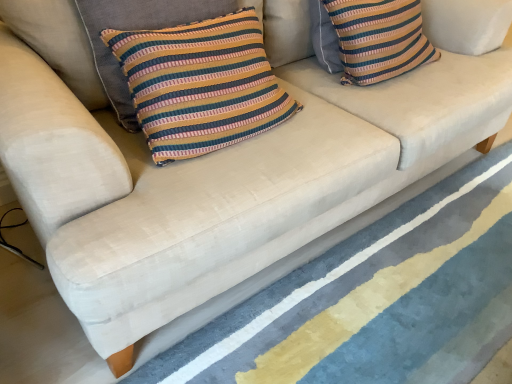
Question: Which direction should I rotate to face striped fabric pillow at center, the first pillow in the left-to-right sequence, — up or down?

Choices:
 (A) up
 (B) down

Answer: (A)

Question: Is striped fabric pillow at center, the first pillow in the left-to-right sequence, wider than striped fabric pillow at upper right, the first pillow when ordered from back to front?

Choices:
 (A) no
 (B) yes

Answer: (A)

Question: Can you confirm if striped fabric pillow at center, the first pillow viewed from the front, is bigger than striped fabric pillow at upper right, acting as the 2th pillow starting from the left?

Choices:
 (A) yes
 (B) no

Answer: (B)

Question: Is the depth of striped fabric pillow at center, the first pillow in the left-to-right sequence, less than that of striped fabric pillow at upper right, arranged as the 1th pillow when viewed from the right?

Choices:
 (A) no
 (B) yes

Answer: (B)

Question: Does striped fabric pillow at center, the first pillow viewed from the front, have a smaller size compared to striped fabric pillow at upper right, arranged as the 1th pillow when viewed from the right?

Choices:
 (A) yes
 (B) no

Answer: (A)

Question: Does striped fabric pillow at center, the first pillow viewed from the front, have a lesser width compared to striped fabric pillow at upper right, acting as the 2th pillow starting from the left?

Choices:
 (A) yes
 (B) no

Answer: (A)

Question: From the image's perspective, would you say striped fabric pillow at center, placed as the 2th pillow when sorted from back to front, is positioned over striped fabric pillow at upper right, the first pillow when ordered from back to front?

Choices:
 (A) yes
 (B) no

Answer: (B)

Question: Does striped fabric pillow at center, placed as the 2th pillow when sorted from back to front, appear on the right side of textured blue rug at lower center?

Choices:
 (A) yes
 (B) no

Answer: (B)

Question: From the image's perspective, is striped fabric pillow at center, the first pillow in the left-to-right sequence, over textured blue rug at lower center?

Choices:
 (A) no
 (B) yes

Answer: (B)

Question: From a real-world perspective, is striped fabric pillow at center, the first pillow viewed from the front, located higher than textured blue rug at lower center?

Choices:
 (A) yes
 (B) no

Answer: (A)

Question: Can you confirm if striped fabric pillow at center, the first pillow viewed from the front, is wider than textured blue rug at lower center?

Choices:
 (A) yes
 (B) no

Answer: (B)

Question: Would you say striped fabric pillow at center, the first pillow viewed from the front, contains textured blue rug at lower center?

Choices:
 (A) no
 (B) yes

Answer: (A)

Question: Could you tell me if striped fabric pillow at center, the second pillow positioned from the right, is facing textured blue rug at lower center?

Choices:
 (A) no
 (B) yes

Answer: (A)

Question: Is striped fabric pillow at upper right, arranged as the 1th pillow when viewed from the right, to the left of textured blue rug at lower center from the viewer's perspective?

Choices:
 (A) yes
 (B) no

Answer: (A)